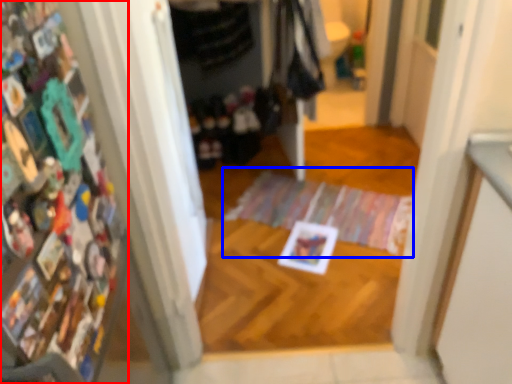
Question: Which point is closer to the camera, book (highlighted by a red box) or doormat (highlighted by a blue box)?

Choices:
 (A) book
 (B) doormat

Answer: (A)